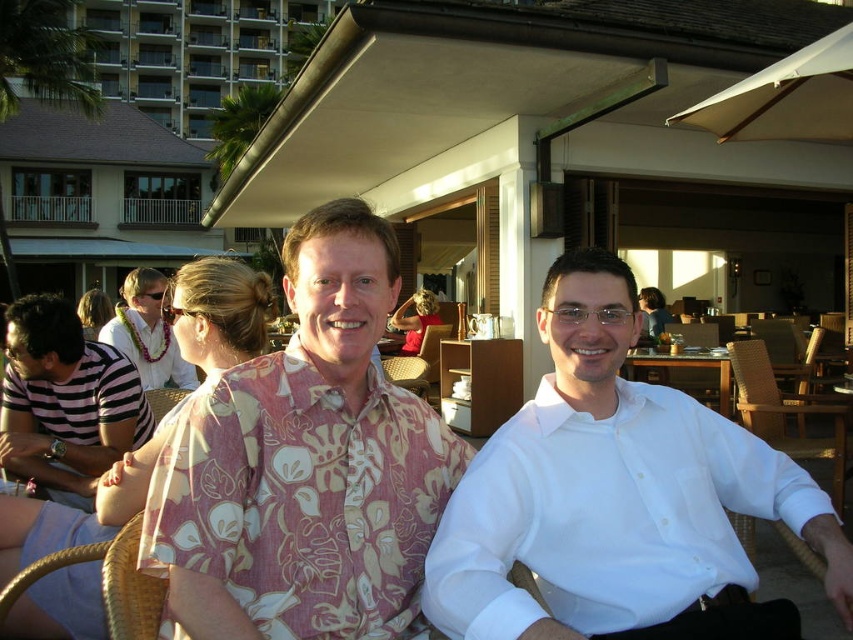
Question: Does floral fabric shirt at center have a smaller size compared to beige fabric chair at center?

Choices:
 (A) yes
 (B) no

Answer: (A)

Question: Is floral fabric shirt at left bigger than striped cotton shirt at left?

Choices:
 (A) yes
 (B) no

Answer: (A)

Question: Which is farther from the beige fabric chair at center?

Choices:
 (A) striped cotton shirt at left
 (B) floral fabric shirt at center

Answer: (B)

Question: In this image, where is white smooth shirt at center located relative to matte pink blouse at center?

Choices:
 (A) right
 (B) left

Answer: (B)

Question: Which point is closer to the camera?

Choices:
 (A) (393, 320)
 (B) (646, 305)
 (C) (115, 522)

Answer: (C)

Question: Which object is the closest to the beige fabric chair at center?

Choices:
 (A) striped cotton shirt at left
 (B) white smooth shirt at center

Answer: (A)